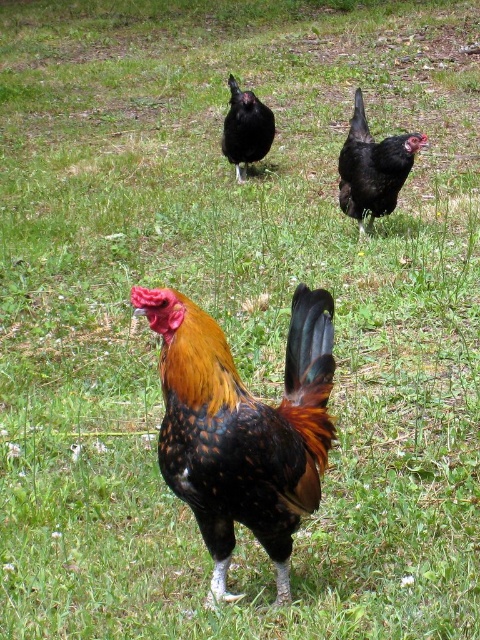
Which is below, multicolored feathered rooster at center or black glossy chicken at upper right?

multicolored feathered rooster at center is lower down.

Find the location of `multicolored feathered rooster at center`. multicolored feathered rooster at center is located at coordinates coord(241,428).

Who is more forward, (317, 448) or (372, 141)?

Point (317, 448) is more forward.

The image size is (480, 640). Identify the location of multicolored feathered rooster at center. (241, 428).

Based on the photo, is black glossy chicken at upper right smaller than black glossy chicken at center?

Yes, black glossy chicken at upper right is smaller than black glossy chicken at center.

The width and height of the screenshot is (480, 640). What are the coordinates of `black glossy chicken at upper right` in the screenshot? It's located at (372, 168).

Is point (370, 150) positioned after point (250, 150)?

No, it is not.

I want to click on black glossy chicken at upper right, so point(372,168).

Based on the photo, how much distance is there between multicolored feathered rooster at center and black glossy chicken at center?

multicolored feathered rooster at center and black glossy chicken at center are 5.24 meters apart.

Between point (217, 394) and point (261, 148), which one is positioned behind?

Positioned behind is point (261, 148).

Between point (305, 310) and point (229, 122), which one is positioned behind?

The point (229, 122) is more distant.

Identify the location of multicolored feathered rooster at center. The width and height of the screenshot is (480, 640). (241, 428).